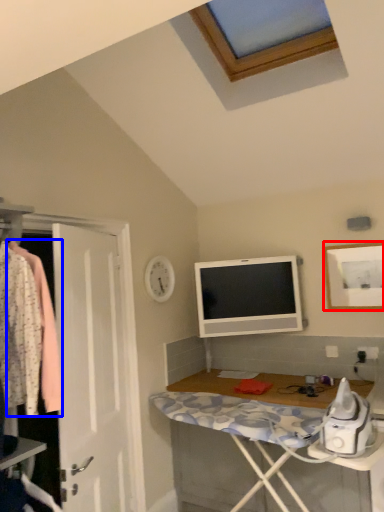
Question: Among these objects, which one is nearest to the camera, picture frame (highlighted by a red box) or clothing (highlighted by a blue box)?

Choices:
 (A) picture frame
 (B) clothing

Answer: (B)